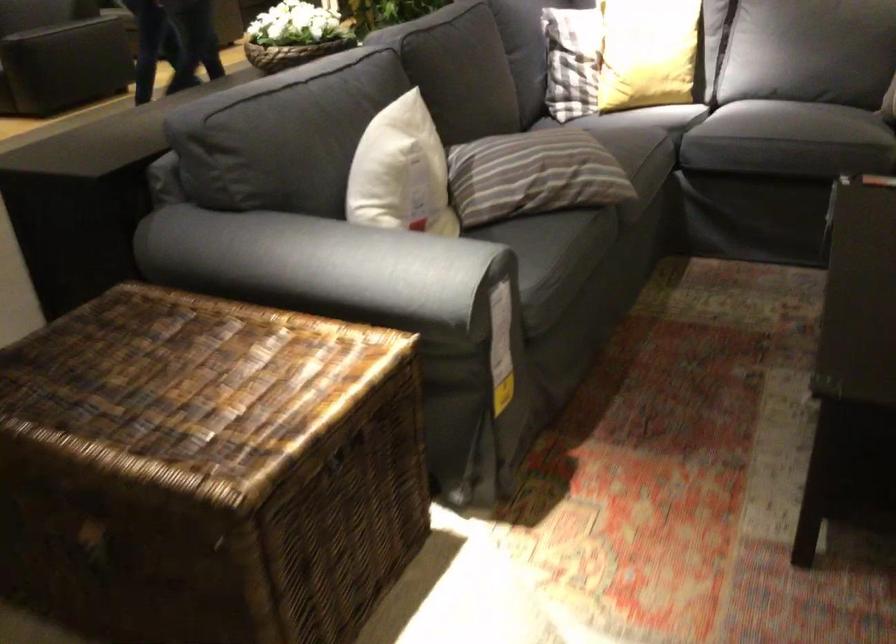
Describe the element at coordinates (572, 61) in the screenshot. I see `the checkered pillow` at that location.